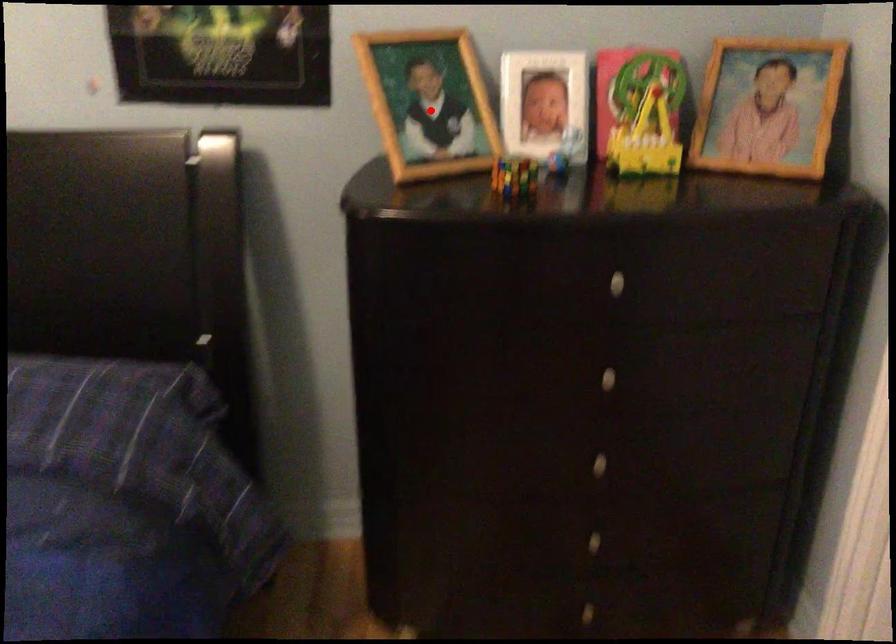
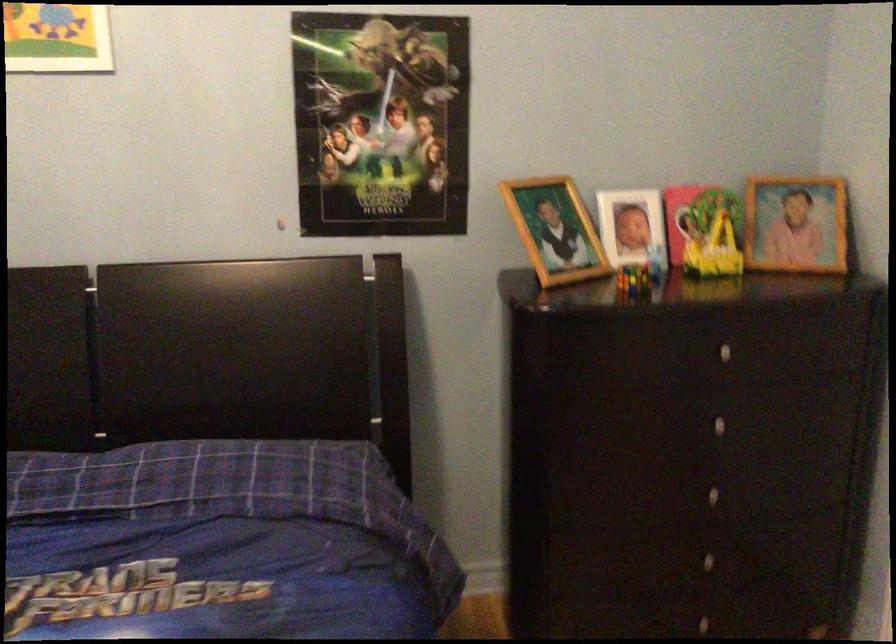
In the second image, find the point that corresponds to the highlighted location in the first image.

(555, 230)